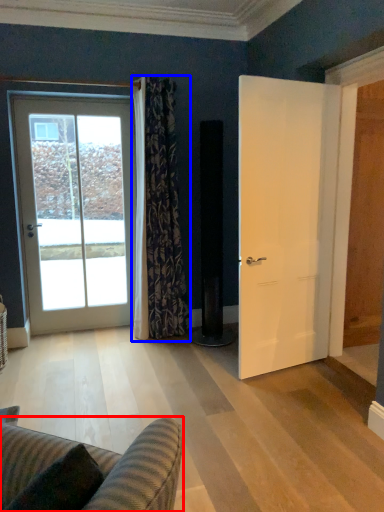
Question: Among these objects, which one is farthest to the camera, studio couch (highlighted by a red box) or curtain (highlighted by a blue box)?

Choices:
 (A) studio couch
 (B) curtain

Answer: (B)